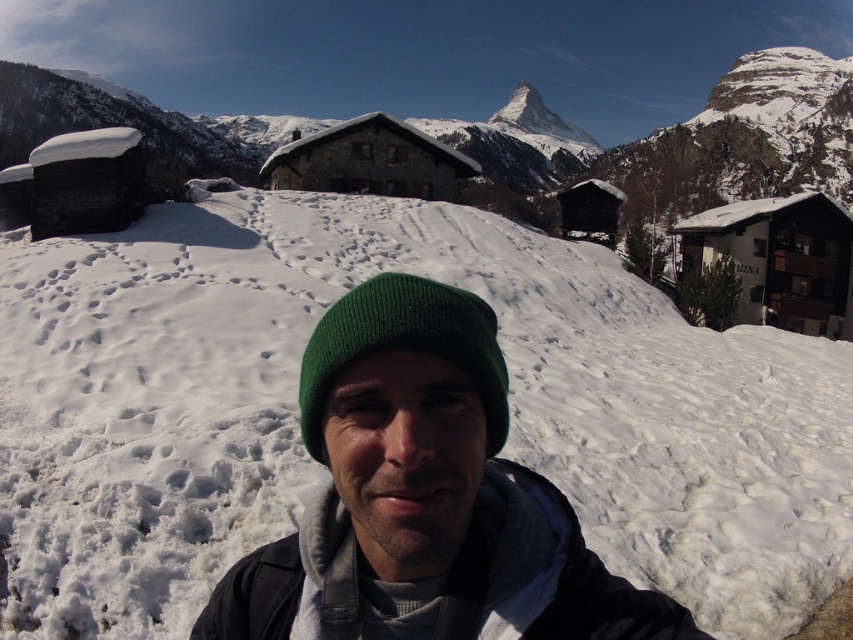
Please provide the exact coordinates of the white fluffy snow at center in the image. The scene is a snowy mountain landscape with a person taking a selfie in the foreground and rustic wooden houses in the background.

The white fluffy snow at center is located at coordinates point (x=323, y=467).

You are standing in the snowy mountain landscape and want to take a selfie with the green knit cap at center and the white fluffy snow at center. Which object should you position closer to the camera to ensure both are in the frame?

To ensure both the green knit cap at center and the white fluffy snow at center are in the frame, position the green knit cap at center closer to the camera since it is to the left of the white fluffy snow at center.

You are standing at the point where the person is taking a selfie in the snowy mountain landscape. You want to place a small flag exactly 10 feet away from your current position. Is the point at coordinates point (x=328, y=525) within the area where you can place the flag?

The distance between point (x=328, y=525) and the viewer is 9.03 feet. Since you want to place the flag 10 feet away, the point is too close. You need to find another location that is 0.97 feet farther away.